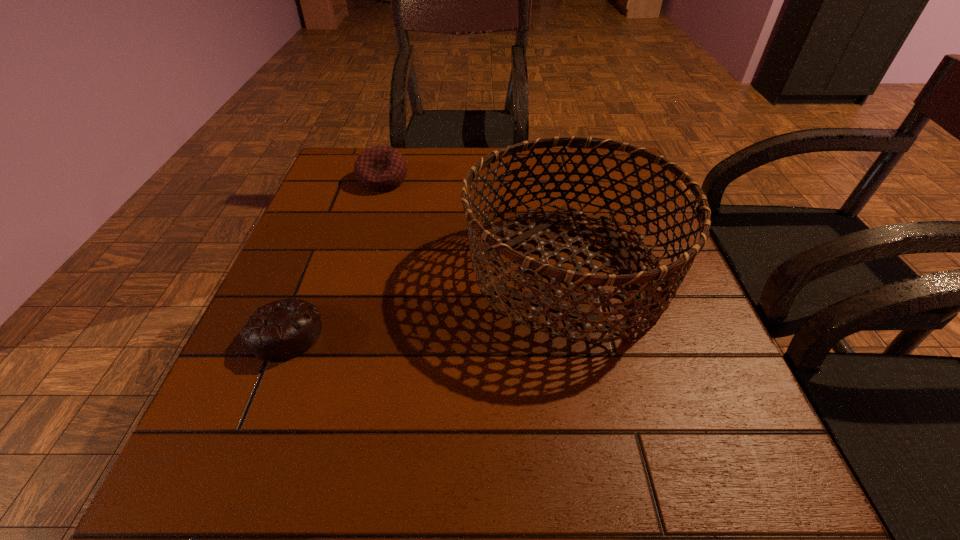
Image resolution: width=960 pixels, height=540 pixels. Find the location of `the rightmost object`. the rightmost object is located at coordinates (594, 283).

Identify the location of basket. (594, 283).

Where is `the farther beanbag`? the farther beanbag is located at coordinates (380, 168).

You are a GUI agent. You are given a task and a screenshot of the screen. Output one action in this format:
    pyautogui.click(x=<x>, y=<y>)
    Task: Click on the farthest object
    
    Given the screenshot: What is the action you would take?
    pyautogui.click(x=380, y=168)

Where is `the nearer beanbag`? The image size is (960, 540). the nearer beanbag is located at coordinates (279, 331).

The height and width of the screenshot is (540, 960). I want to click on the shorter beanbag, so click(x=279, y=331).

Image resolution: width=960 pixels, height=540 pixels. In order to click on free space located on the back of the rightmost object in this screenshot , I will do (546, 160).

Find the location of a particular element. This screenshot has height=540, width=960. vacant position located 0.130m on the right of the farther beanbag is located at coordinates (459, 180).

Where is `free spot located 0.290m on the back of the shortest object`? free spot located 0.290m on the back of the shortest object is located at coordinates coord(333,214).

The width and height of the screenshot is (960, 540). I want to click on object that is at the far edge, so pos(380,168).